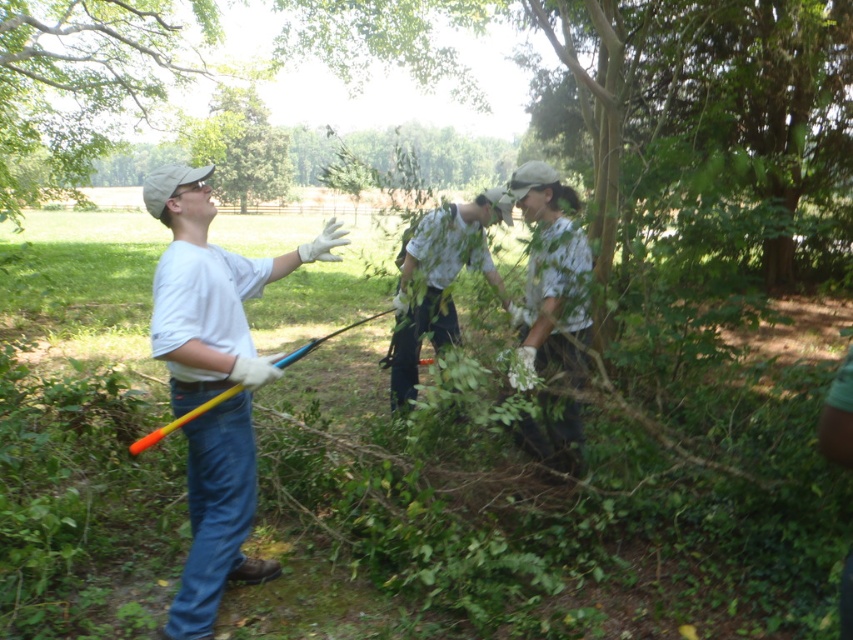
Who is more distant from viewer, [221,458] or [567,339]?

The point [567,339] is more distant.

Is point (171, 310) positioned after point (585, 236)?

No, (171, 310) is closer to viewer.

This screenshot has height=640, width=853. I want to click on white matte shirt at left, so click(x=213, y=381).

This screenshot has height=640, width=853. I want to click on white matte shirt at left, so click(x=213, y=381).

How far apart are white matte shirt at left and light gray cotton shirt at center?

white matte shirt at left is 1.56 meters from light gray cotton shirt at center.

Is point (229, 484) positioned in front of point (482, 227)?

Yes, point (229, 484) is in front of point (482, 227).

This screenshot has height=640, width=853. Identify the location of white matte shirt at left. (213, 381).

Is green leafy tree at upper left taller than white cotton shirt at center?

Yes.

Is point (103, 72) farther from viewer compared to point (575, 305)?

Yes.

This screenshot has height=640, width=853. Identify the location of green leafy tree at upper left. (78, 84).

The image size is (853, 640). What are the coordinates of `green leafy tree at upper left` in the screenshot? It's located at (78, 84).